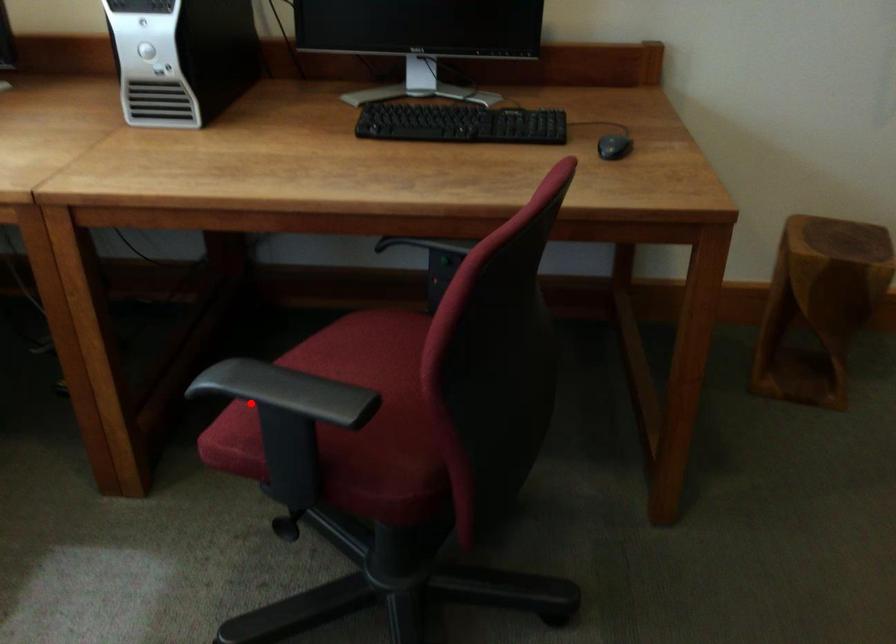
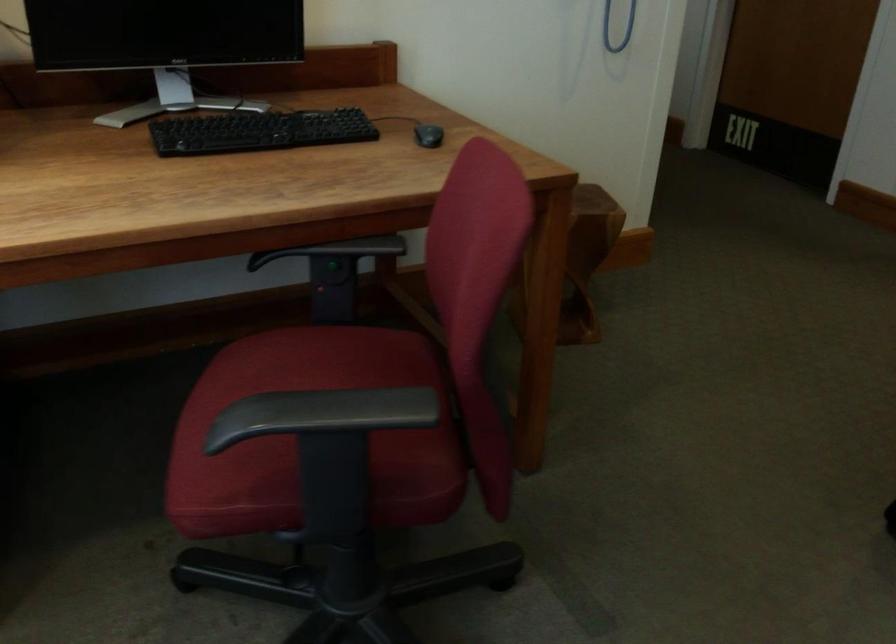
Locate, in the second image, the point that corresponds to the highlighted location in the first image.

(309, 433)